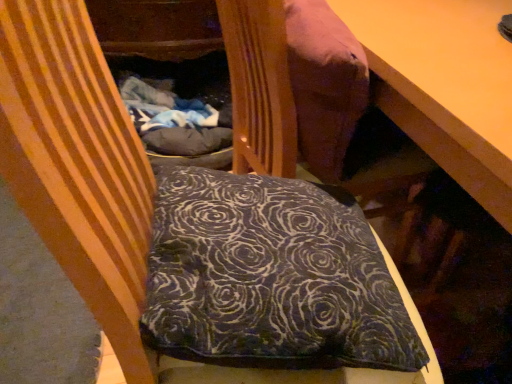
Question: From a real-world perspective, is dark blue velvety pillow at center located higher than velvet-like brown bean bag at upper center?

Choices:
 (A) no
 (B) yes

Answer: (A)

Question: Does dark blue velvety pillow at center have a greater height compared to velvet-like brown bean bag at upper center?

Choices:
 (A) no
 (B) yes

Answer: (A)

Question: Considering the relative sizes of dark blue velvety pillow at center and velvet-like brown bean bag at upper center in the image provided, is dark blue velvety pillow at center shorter than velvet-like brown bean bag at upper center?

Choices:
 (A) no
 (B) yes

Answer: (B)

Question: Can you confirm if dark blue velvety pillow at center is wider than velvet-like brown bean bag at upper center?

Choices:
 (A) yes
 (B) no

Answer: (A)

Question: Does dark blue velvety pillow at center come behind velvet-like brown bean bag at upper center?

Choices:
 (A) yes
 (B) no

Answer: (B)

Question: Considering the relative sizes of dark blue velvety pillow at center and velvet-like brown bean bag at upper center in the image provided, is dark blue velvety pillow at center thinner than velvet-like brown bean bag at upper center?

Choices:
 (A) no
 (B) yes

Answer: (A)

Question: Is velvet-like brown bean bag at upper center surrounding dark blue velvety pillow at center?

Choices:
 (A) yes
 (B) no

Answer: (B)

Question: Can you confirm if velvet-like brown bean bag at upper center is thinner than dark blue velvety pillow at center?

Choices:
 (A) no
 (B) yes

Answer: (B)

Question: Is velvet-like brown bean bag at upper center to the right of dark blue velvety pillow at center from the viewer's perspective?

Choices:
 (A) no
 (B) yes

Answer: (B)

Question: Can you confirm if velvet-like brown bean bag at upper center is positioned to the left of dark blue velvety pillow at center?

Choices:
 (A) yes
 (B) no

Answer: (B)

Question: From a real-world perspective, is velvet-like brown bean bag at upper center on dark blue velvety pillow at center?

Choices:
 (A) yes
 (B) no

Answer: (A)

Question: From the image's perspective, would you say velvet-like brown bean bag at upper center is positioned over dark blue velvety pillow at center?

Choices:
 (A) yes
 (B) no

Answer: (A)

Question: Relative to velvet-like brown bean bag at upper center, is dark blue velvety pillow at center in front or behind?

Choices:
 (A) front
 (B) behind

Answer: (A)